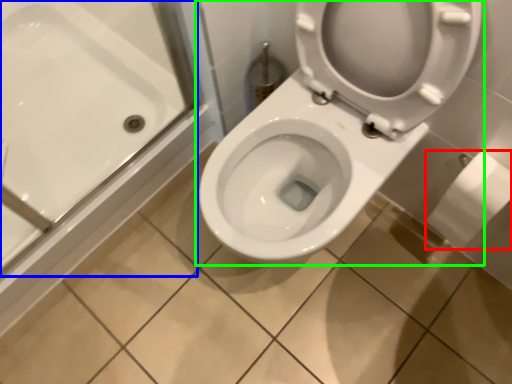
Question: Estimate the real-world distances between objects in this image. Which object is farther from toilet paper (highlighted by a red box), bath (highlighted by a blue box) or toilet (highlighted by a green box)?

Choices:
 (A) bath
 (B) toilet

Answer: (A)